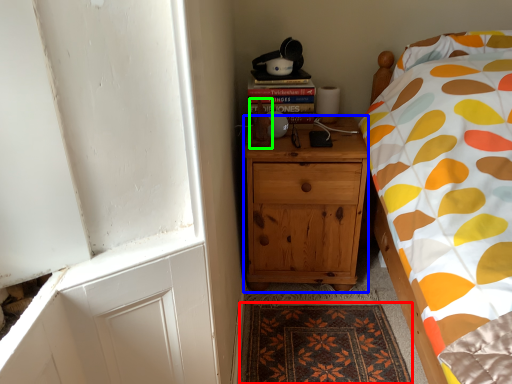
Question: Considering the real-world distances, which object is farthest from mat (highlighted by a red box)? cabinetry (highlighted by a blue box) or toy (highlighted by a green box)?

Choices:
 (A) cabinetry
 (B) toy

Answer: (B)